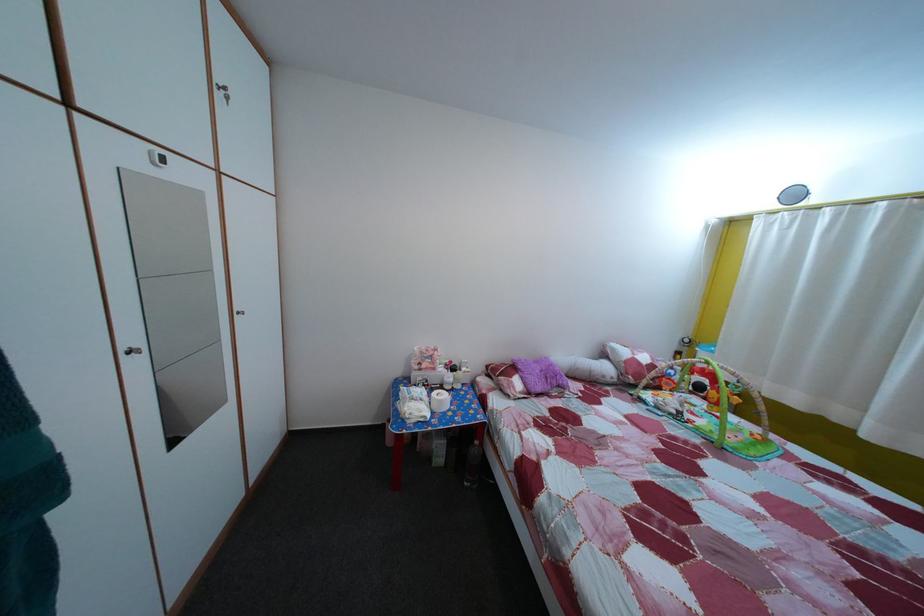
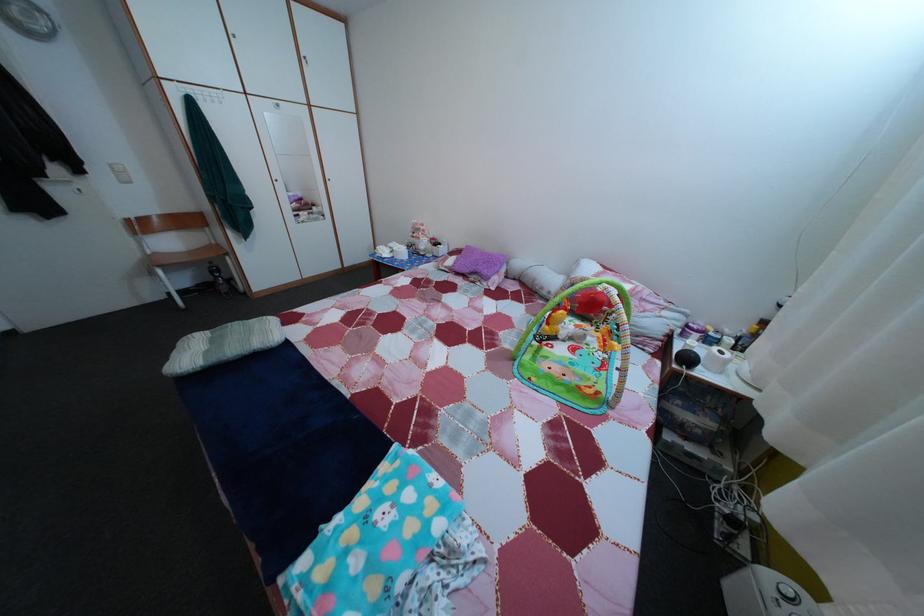
The point at (545, 370) is marked in the first image. Where is the corresponding point in the second image?

(492, 261)